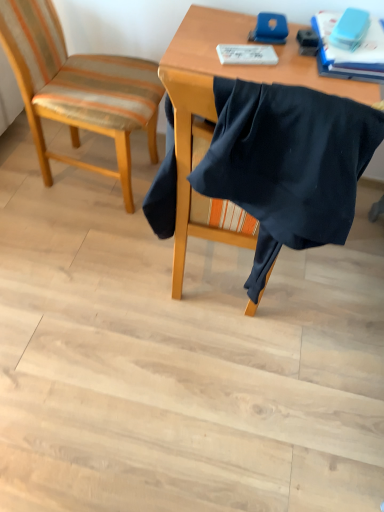
You are a GUI agent. You are given a task and a screenshot of the screen. Output one action in this format:
    pyautogui.click(x=<x>, y=<y>)
    Task: Click on the free area behind white paper at upper center
    This screenshot has width=384, height=512.
    Given the screenshot: What is the action you would take?
    pyautogui.click(x=238, y=24)